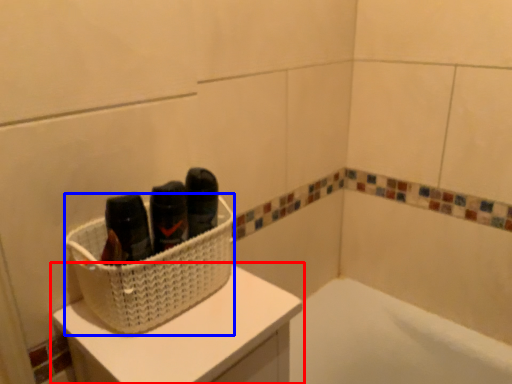
Question: Which of the following is the farthest to the observer, furniture (highlighted by a red box) or basket (highlighted by a blue box)?

Choices:
 (A) furniture
 (B) basket

Answer: (B)